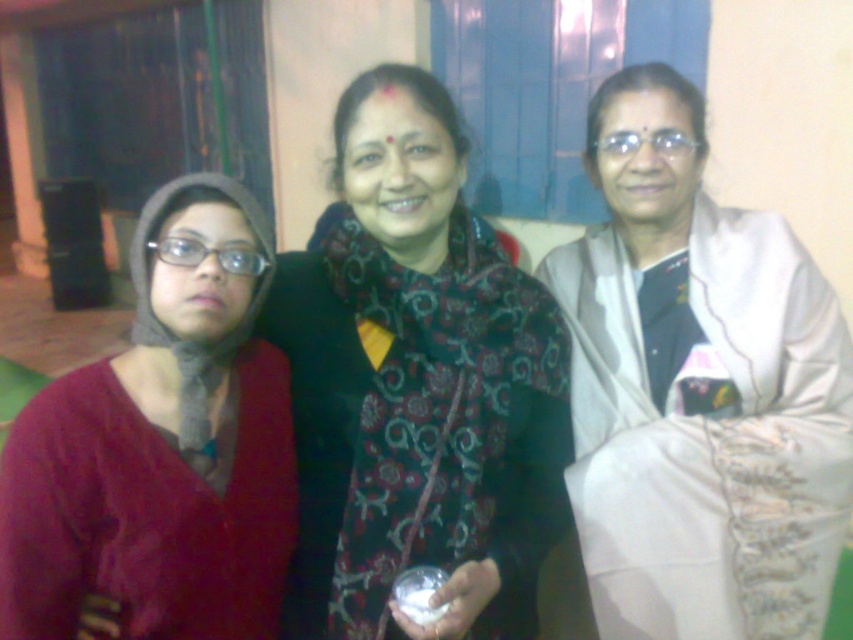
Question: Among these points, which one is nearest to the camera?

Choices:
 (A) (132, 490)
 (B) (440, 132)
 (C) (656, 224)

Answer: (A)

Question: Which of these objects is positioned closest to the knitted woolen scarf at left?

Choices:
 (A) white satin saree at right
 (B) black floral scarf at center

Answer: (B)

Question: From the image, what is the correct spatial relationship of black floral scarf at center in relation to knitted woolen scarf at left?

Choices:
 (A) above
 (B) below

Answer: (A)

Question: Which of the following is the closest to the observer?

Choices:
 (A) (786, 483)
 (B) (132, 394)

Answer: (B)

Question: Observing the image, what is the correct spatial positioning of black floral scarf at center in reference to knitted woolen scarf at left?

Choices:
 (A) above
 (B) below

Answer: (A)

Question: Can you confirm if black floral scarf at center is bigger than knitted woolen scarf at left?

Choices:
 (A) yes
 (B) no

Answer: (A)